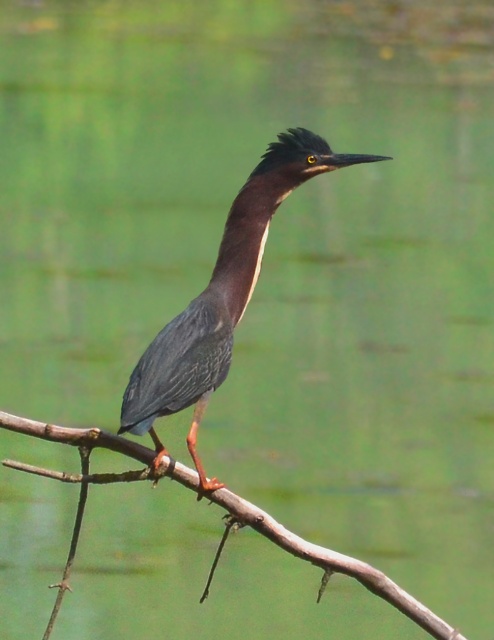
Is green matte bird at center wider than green glossy neck at center?

Correct, the width of green matte bird at center exceeds that of green glossy neck at center.

Where is `green matte bird at center`? The height and width of the screenshot is (640, 494). green matte bird at center is located at coordinates (221, 298).

Find the location of a particular element. This screenshot has height=640, width=494. green matte bird at center is located at coordinates (221, 298).

Measure the distance between green matte bird at center and camera.

green matte bird at center is 2.25 meters from camera.

Can you confirm if green matte bird at center is positioned to the left of brown wood tree branch at center?

In fact, green matte bird at center is to the right of brown wood tree branch at center.

Where is `green matte bird at center`? This screenshot has width=494, height=640. green matte bird at center is located at coordinates (221, 298).

Between brown wood tree branch at center and green glossy neck at center, which one appears on the left side from the viewer's perspective?

brown wood tree branch at center

Is brown wood tree branch at center smaller than green glossy neck at center?

No, brown wood tree branch at center is not smaller than green glossy neck at center.

Is point (41, 432) less distant than point (264, 180)?

Yes, it is.

Locate an element on the screen. brown wood tree branch at center is located at coordinates (332, 563).